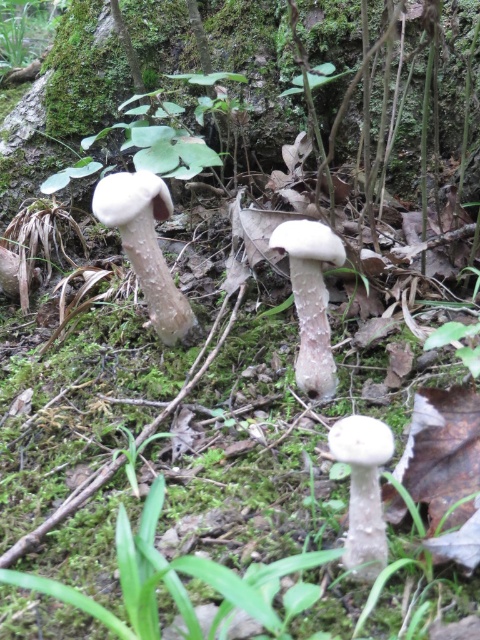
Who is shorter, white matte mushroom at left or white matte mushroom at center?

With less height is white matte mushroom at center.

Does point (132, 179) come in front of point (346, 547)?

No.

Describe the element at coordinates (144, 244) in the screenshot. This screenshot has height=640, width=480. I see `white matte mushroom at left` at that location.

The image size is (480, 640). What are the coordinates of `white matte mushroom at left` in the screenshot? It's located at (144, 244).

Which is in front, point (142, 250) or point (330, 384)?

Point (330, 384)

Who is shorter, white matte mushroom at left or white fuzzy mushroom at center?

white fuzzy mushroom at center is shorter.

Which is behind, point (156, 285) or point (314, 298)?

Point (156, 285)

I want to click on white matte mushroom at left, so click(144, 244).

Which is more to the right, white fuzzy mushroom at center or white matte mushroom at center?

From the viewer's perspective, white matte mushroom at center appears more on the right side.

Is point (295, 259) positioned before point (358, 451)?

That is False.

The width and height of the screenshot is (480, 640). What are the coordinates of `white fuzzy mushroom at center` in the screenshot? It's located at (311, 300).